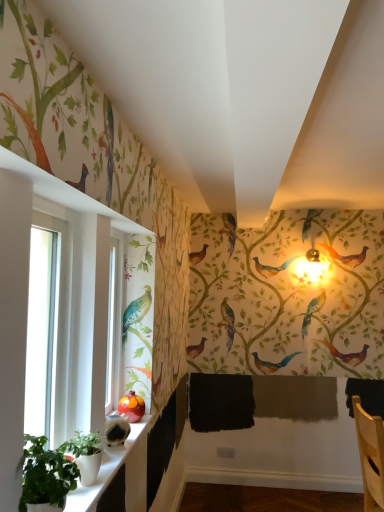
Question: Considering the positions of white ceramic window sill at lower left and clear glass window at left in the image, is white ceramic window sill at lower left taller or shorter than clear glass window at left?

Choices:
 (A) short
 (B) tall

Answer: (A)

Question: Based on their positions, is white ceramic window sill at lower left located to the left or right of clear glass window at left?

Choices:
 (A) right
 (B) left

Answer: (A)

Question: Estimate the real-world distances between objects in this image. Which object is farther from the clear glass window at left?

Choices:
 (A) white ceramic window sill at lower left
 (B) green matte plant at lower left, positioned as the 1th plant in back-to-front order
 (C) green matte plant at lower left, acting as the 1th plant starting from the front

Answer: (A)

Question: Which object is the closest to the green matte plant at lower left, positioned as the 1th plant in back-to-front order?

Choices:
 (A) white ceramic window sill at lower left
 (B) green matte plant at lower left, acting as the 1th plant starting from the front
 (C) clear glass window at left

Answer: (A)